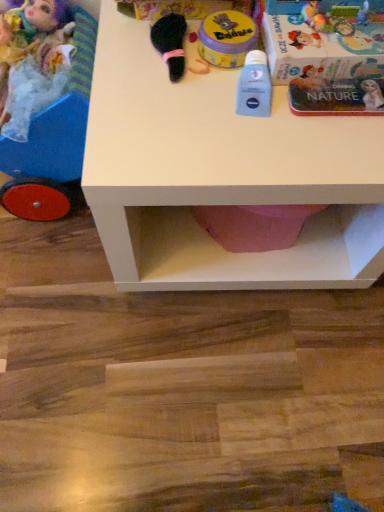
What are the coordinates of `vacant area to the left of blue matte lotion at center, the 1th toy viewed from the right` in the screenshot? It's located at (156, 105).